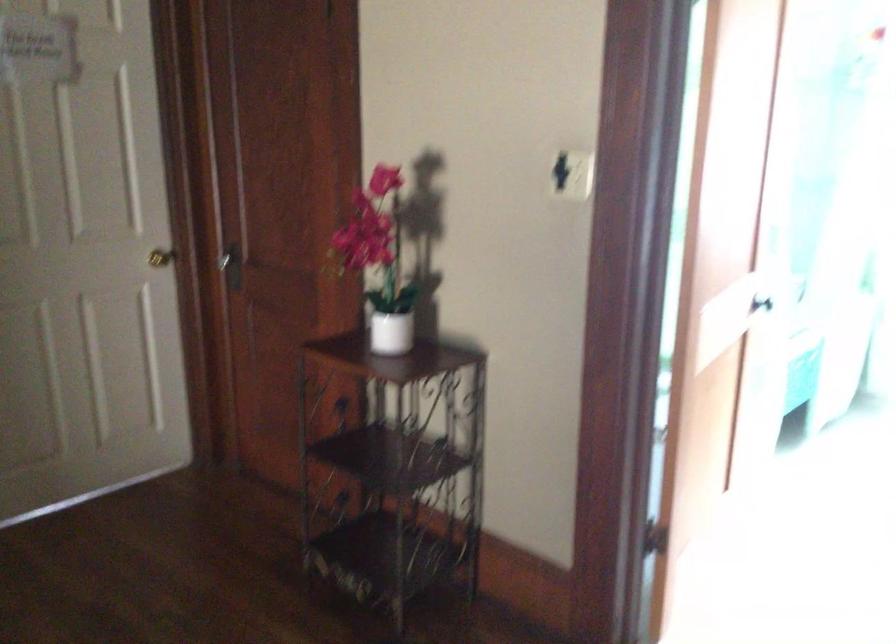
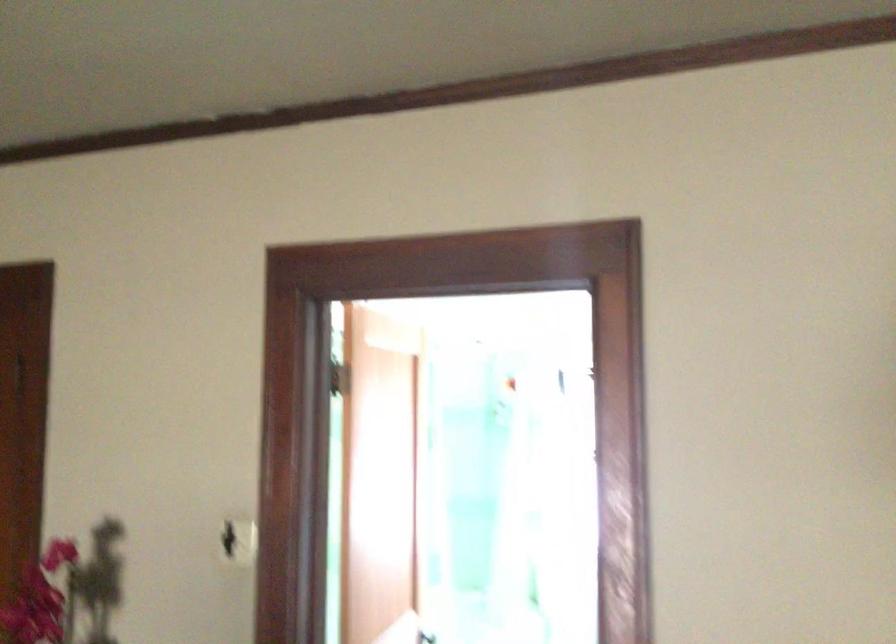
Find the pixel in the second image that matches (x=563, y=172) in the first image.

(228, 540)